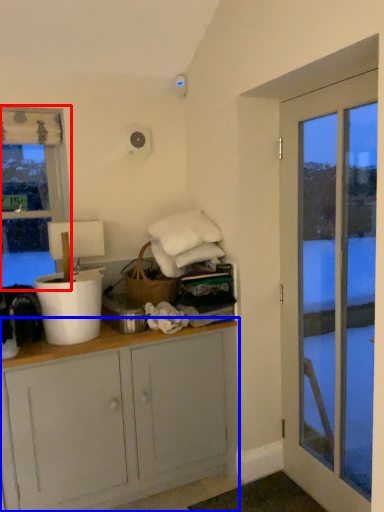
Question: Among these objects, which one is farthest to the camera, window (highlighted by a red box) or cabinetry (highlighted by a blue box)?

Choices:
 (A) window
 (B) cabinetry

Answer: (A)